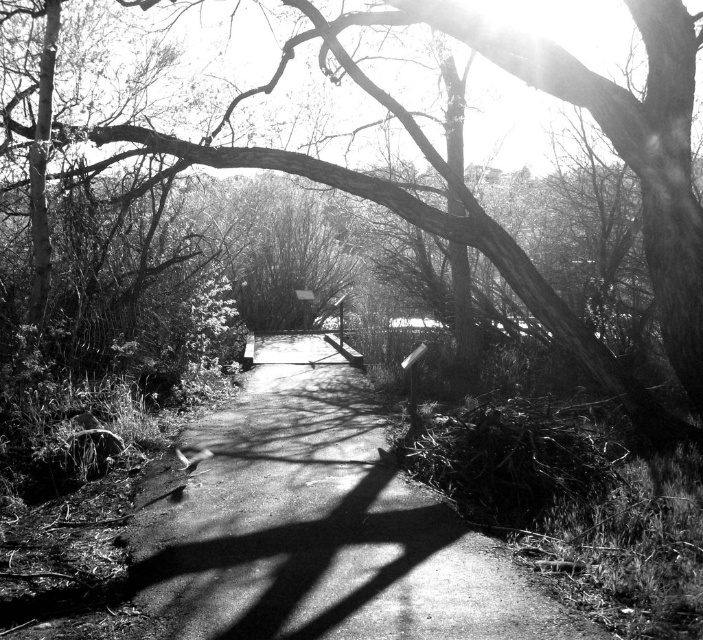
Between point (221, 531) and point (304, 3), which one is positioned in front?

Point (221, 531) is in front.

Between point (193, 515) and point (406, 125), which one is positioned in front?

Positioned in front is point (193, 515).

Locate an element on the screen. The width and height of the screenshot is (703, 640). smooth concrete path at center is located at coordinates (318, 525).